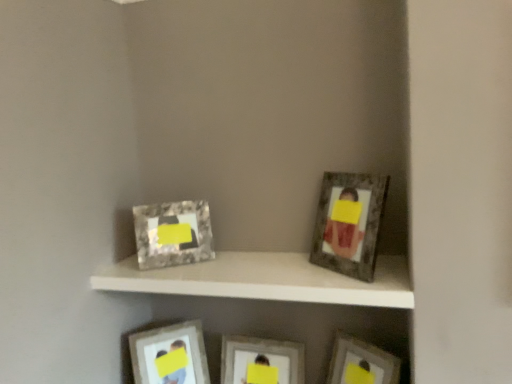
Question: From the image's perspective, would you say matte silver picture frame at lower center, the first picture frame when ordered from left to right, is positioned over marble-like frame at upper left, the fourth picture frame positioned from the right?

Choices:
 (A) no
 (B) yes

Answer: (A)

Question: Does matte silver picture frame at lower center, acting as the fifth picture frame starting from the right, have a larger size compared to marble-like frame at upper left, the fourth picture frame positioned from the right?

Choices:
 (A) yes
 (B) no

Answer: (A)

Question: Is matte silver picture frame at lower center, the first picture frame when ordered from left to right, closer to camera compared to marble-like frame at upper left, the fourth picture frame positioned from the right?

Choices:
 (A) yes
 (B) no

Answer: (B)

Question: Is matte silver picture frame at lower center, the first picture frame when ordered from left to right, wider than marble-like frame at upper left, positioned as the 2th picture frame in left-to-right order?

Choices:
 (A) no
 (B) yes

Answer: (B)

Question: Considering the relative positions of matte silver picture frame at lower center, acting as the fifth picture frame starting from the right, and marble-like frame at upper left, positioned as the 2th picture frame in left-to-right order, in the image provided, is matte silver picture frame at lower center, acting as the fifth picture frame starting from the right, to the right of marble-like frame at upper left, positioned as the 2th picture frame in left-to-right order, from the viewer's perspective?

Choices:
 (A) no
 (B) yes

Answer: (A)

Question: From a real-world perspective, is matte silver picture frame at lower center, the first picture frame when ordered from left to right, over marble-like frame at upper left, the fourth picture frame positioned from the right?

Choices:
 (A) yes
 (B) no

Answer: (B)

Question: From the image's perspective, is matte silver picture frame at center, which ranks as the third picture frame in right-to-left order, below marble-like frame at upper left, the fourth picture frame positioned from the right?

Choices:
 (A) no
 (B) yes

Answer: (B)

Question: Does matte silver picture frame at center, which ranks as the third picture frame in right-to-left order, have a smaller size compared to marble-like frame at upper left, the fourth picture frame positioned from the right?

Choices:
 (A) no
 (B) yes

Answer: (A)

Question: Is matte silver picture frame at center, arranged as the third picture frame when viewed from the left, positioned with its back to marble-like frame at upper left, positioned as the 2th picture frame in left-to-right order?

Choices:
 (A) no
 (B) yes

Answer: (A)

Question: Is matte silver picture frame at center, arranged as the third picture frame when viewed from the left, bigger than marble-like frame at upper left, positioned as the 2th picture frame in left-to-right order?

Choices:
 (A) yes
 (B) no

Answer: (A)

Question: From a real-world perspective, is matte silver picture frame at center, arranged as the third picture frame when viewed from the left, over marble-like frame at upper left, positioned as the 2th picture frame in left-to-right order?

Choices:
 (A) yes
 (B) no

Answer: (B)

Question: Is matte silver picture frame at center, which ranks as the third picture frame in right-to-left order, wider than marble-like frame at upper left, the fourth picture frame positioned from the right?

Choices:
 (A) yes
 (B) no

Answer: (A)

Question: From the image's perspective, is marble-like frame at upper left, positioned as the 2th picture frame in left-to-right order, beneath metallic silver picture frame at lower right, acting as the 5th picture frame starting from the left?

Choices:
 (A) no
 (B) yes

Answer: (A)